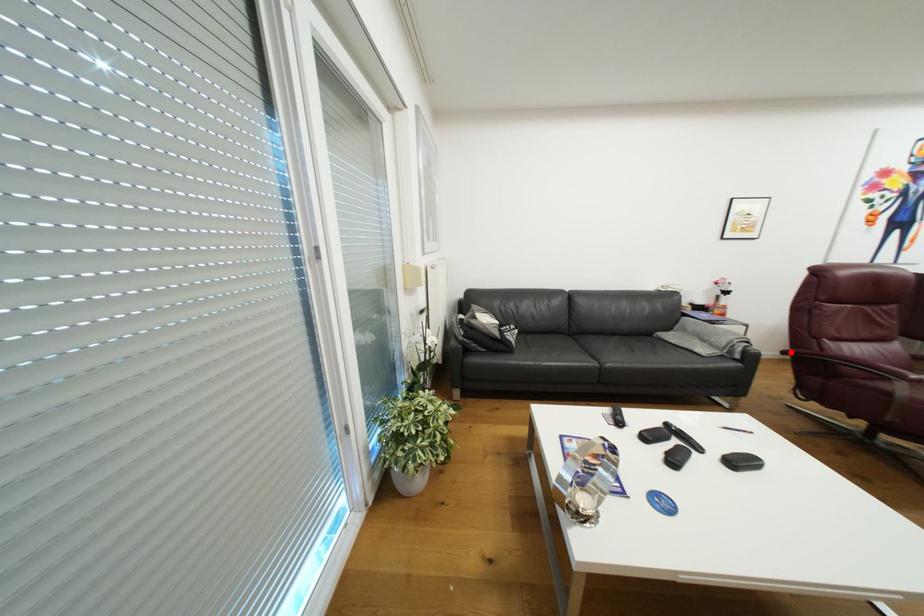
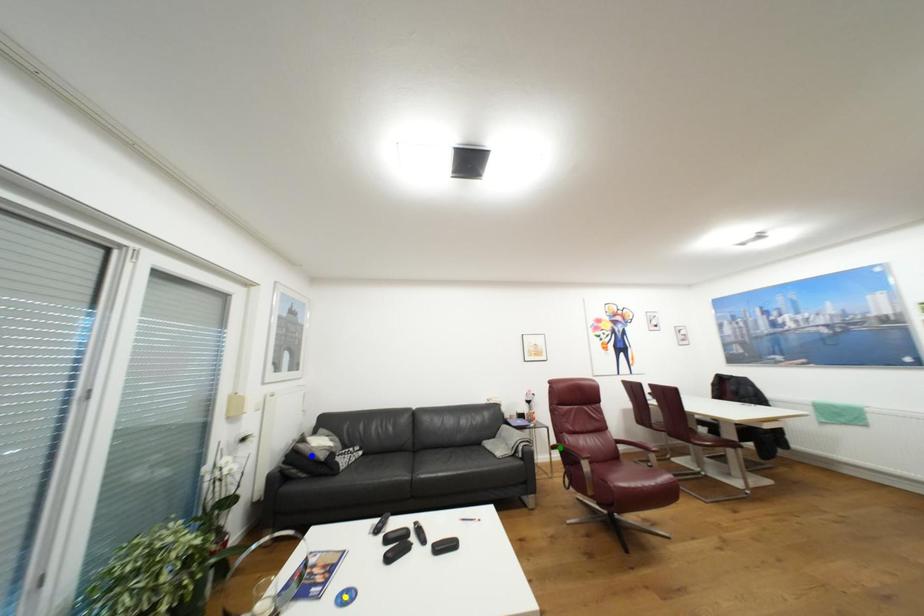
Question: I am providing you with two images of the same scene from different viewpoints. A red point is marked on the first image. You are given multiple points on the second image. Which spot in image 2 lines up with the point in image 1?

Choices:
 (A) green point
 (B) blue point
 (C) yellow point

Answer: (A)